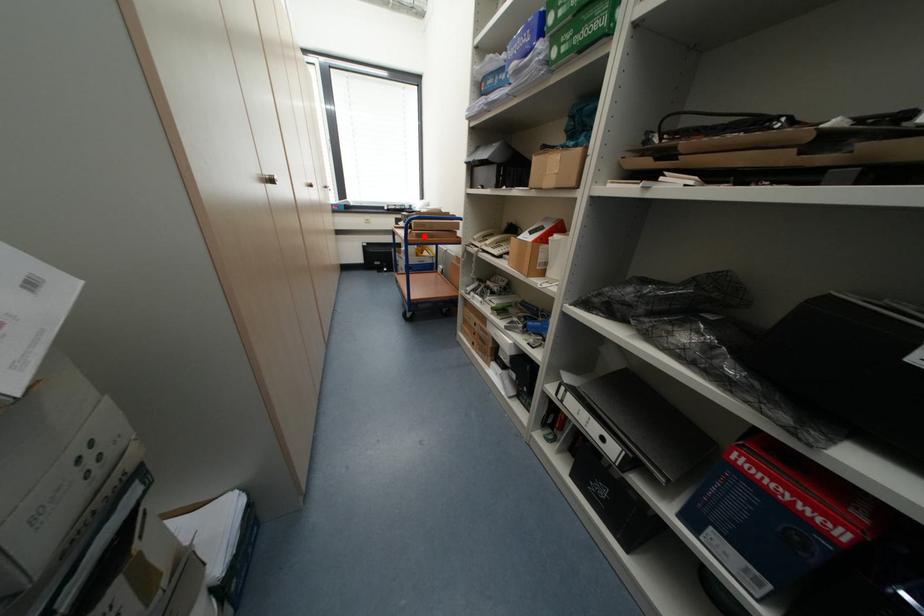
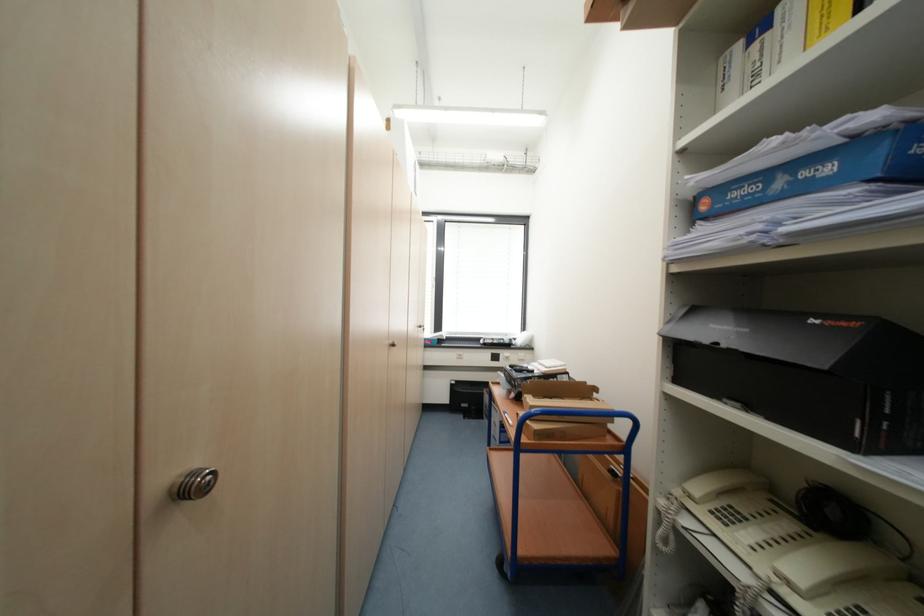
Question: I am providing you with two images of the same scene from different viewpoints. Image1 has a red point marked. In image2, the corresponding 3D location appears at what relative position? Reply with the corresponding letter.

Choices:
 (A) Closer
 (B) Farther

Answer: (B)